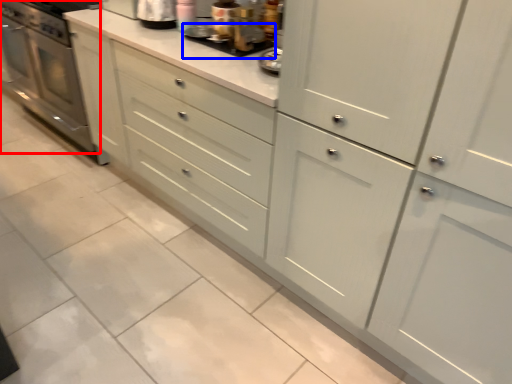
Question: Among these objects, which one is nearest to the camera, home appliance (highlighted by a red box) or appliance (highlighted by a blue box)?

Choices:
 (A) home appliance
 (B) appliance

Answer: (B)